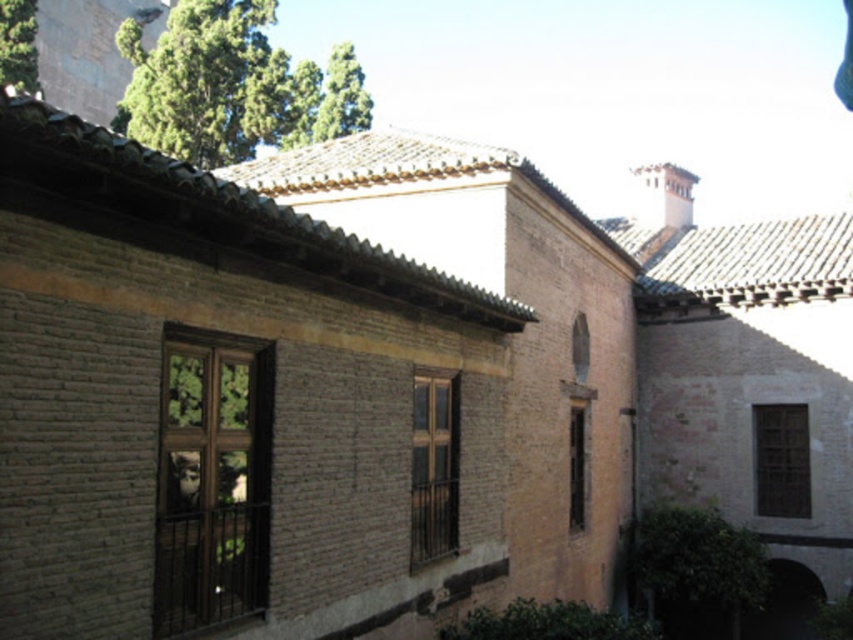
Does wooden window at center have a lesser height compared to brown wooden window at lower right?

Yes.

Based on the photo, does wooden window at center lie in front of brown wooden window at lower right?

Yes.

Does point (438, 394) lie in front of point (776, 436)?

Yes.

This screenshot has height=640, width=853. Find the location of `wooden window at center`. wooden window at center is located at coordinates (433, 468).

Who is higher up, brown wooden window at center or wooden window at center?

brown wooden window at center

Can you confirm if brown wooden window at center is smaller than wooden window at center?

No.

This screenshot has height=640, width=853. Describe the element at coordinates (212, 483) in the screenshot. I see `brown wooden window at center` at that location.

Where is `brown wooden window at center`? brown wooden window at center is located at coordinates (212, 483).

Who is more distant from viewer, (x=229, y=520) or (x=787, y=474)?

Positioned behind is point (x=787, y=474).

Between brown wooden window at center and brown wooden window at lower right, which one has more height?

With more height is brown wooden window at center.

This screenshot has width=853, height=640. Find the location of `brown wooden window at center`. brown wooden window at center is located at coordinates (212, 483).